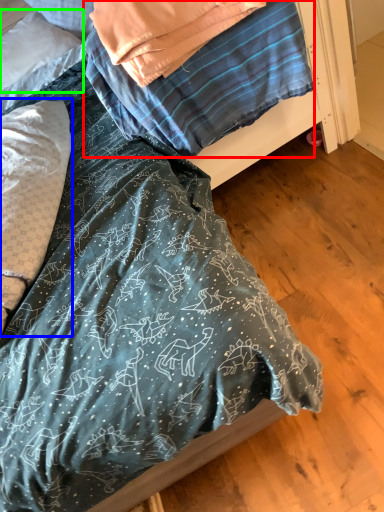
Question: Which object is positioned farthest from blanket (highlighted by a red box)? Select from pillow (highlighted by a blue box) and pillow (highlighted by a green box).

Choices:
 (A) pillow
 (B) pillow

Answer: (B)